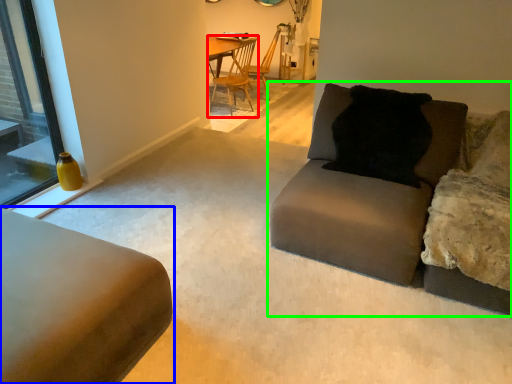
Question: Which object is the closest to the chair (highlighted by a red box)? Choose among these: studio couch (highlighted by a blue box) or studio couch (highlighted by a green box).

Choices:
 (A) studio couch
 (B) studio couch

Answer: (B)